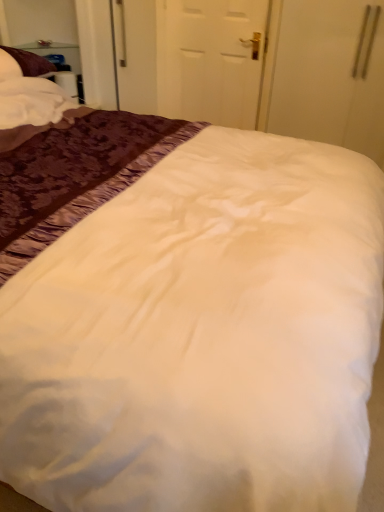
Find the location of `white matte door at center`. white matte door at center is located at coordinates (211, 59).

What do you see at coordinates (211, 59) in the screenshot? I see `white matte door at center` at bounding box center [211, 59].

The height and width of the screenshot is (512, 384). What are the coordinates of `white matte door at center` in the screenshot? It's located at (211, 59).